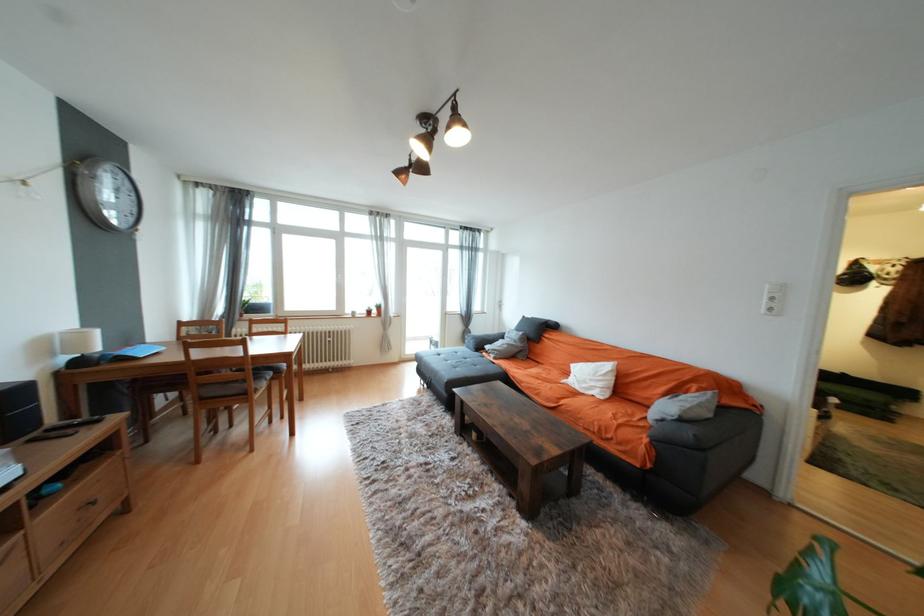
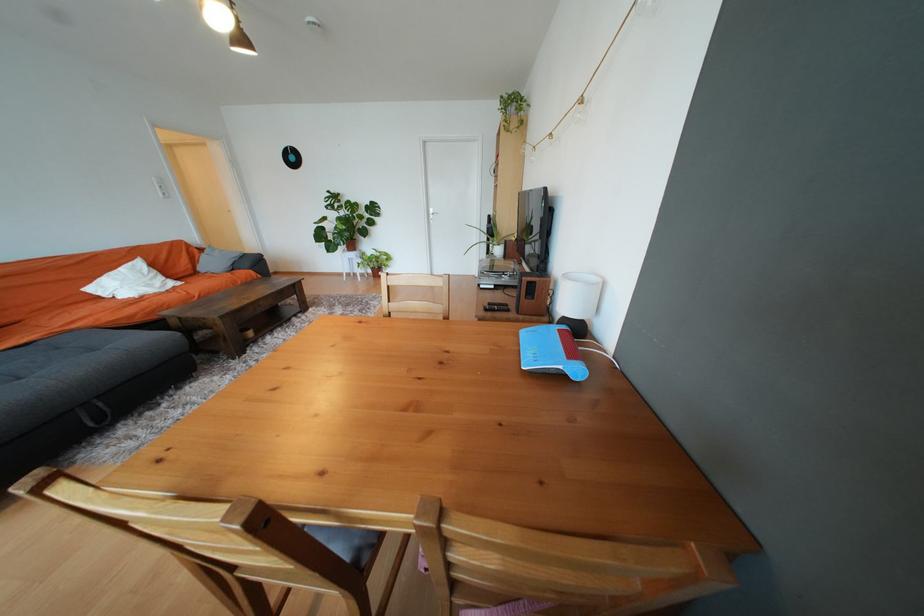
Locate, in the second image, the point that corresponds to the point at 578,368 in the first image.

(96, 291)